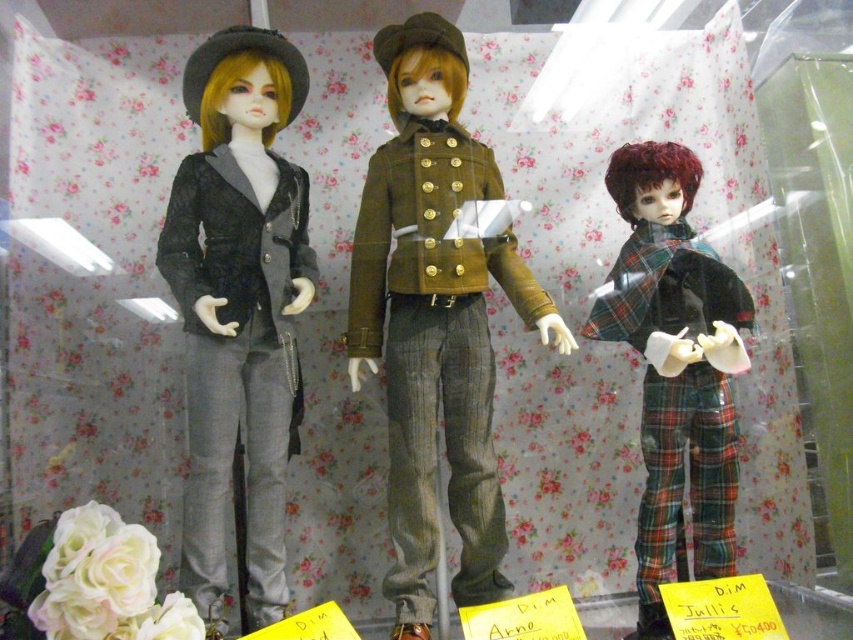
Can you confirm if matte brown jacket at center is smaller than plaid fabric pantsuit at right?

Actually, matte brown jacket at center might be larger than plaid fabric pantsuit at right.

Can you confirm if matte brown jacket at center is thinner than plaid fabric pantsuit at right?

In fact, matte brown jacket at center might be wider than plaid fabric pantsuit at right.

Find the location of a particular element. Image resolution: width=853 pixels, height=640 pixels. matte brown jacket at center is located at coordinates (434, 349).

Consider the image. How far apart are matte brown jacket at center and matte black jacket at left?

A distance of 8.35 inches exists between matte brown jacket at center and matte black jacket at left.

Does matte brown jacket at center appear on the right side of matte black jacket at left?

Correct, you'll find matte brown jacket at center to the right of matte black jacket at left.

Does point (419, 122) come behind point (252, 616)?

Yes.

Where is `matte brown jacket at center`? The width and height of the screenshot is (853, 640). matte brown jacket at center is located at coordinates (434, 349).

Can you confirm if matte black jacket at left is smaller than plaid fabric pantsuit at right?

No.

Between matte black jacket at left and plaid fabric pantsuit at right, which one is positioned lower?

plaid fabric pantsuit at right is below.

At what (x,y) coordinates should I click in order to perform the action: click on matte black jacket at left. Please return your answer as a coordinate pair (x, y). The height and width of the screenshot is (640, 853). Looking at the image, I should click on (236, 364).

At what (x,y) coordinates should I click in order to perform the action: click on matte black jacket at left. Please return your answer as a coordinate pair (x, y). This screenshot has width=853, height=640. Looking at the image, I should click on (236, 364).